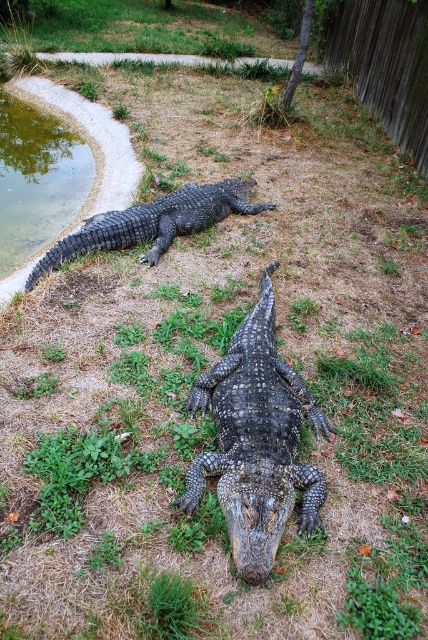
You are a wildlife photographer aiming to capture both the shiny black crocodile at center and the dark scaly crocodile at center in a single frame. Based on their positions, which crocodile is located to the right of the other?

The shiny black crocodile at center is positioned on the right side of dark scaly crocodile at center.

You are a wildlife photographer aiming to capture both the shiny black crocodile at center and the dark scaly crocodile at center in a single frame. Given that your camera has a fixed focal length, which crocodile would you need to position closer to ensure it fills the frame adequately?

The shiny black crocodile at center is thinner than the dark scaly crocodile at center, so you should position the shiny black crocodile at center closer to the camera to ensure it fills the frame adequately.

You are standing at the entrance of the pathway and want to reach the shiny black crocodile at center. Which direction should you move to get closer to it?

Since the shiny black crocodile at center is located at point (255, 442), you should move towards the center of the image to reach it.